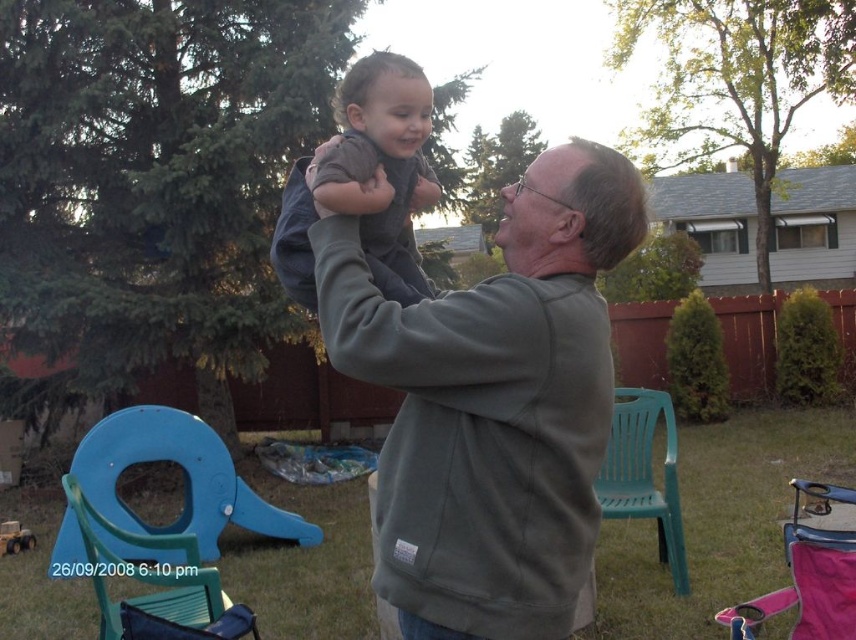
Question: Does pink fabric chair at lower right appear on the right side of green plastic chair at right?

Choices:
 (A) no
 (B) yes

Answer: (B)

Question: Which object is the farthest from the green plastic chair at right?

Choices:
 (A) matte gray hoodie at center
 (B) pink fabric chair at lower right
 (C) olive green sweatshirt at center

Answer: (C)

Question: Which point appears farthest from the camera in this image?

Choices:
 (A) (649, 417)
 (B) (189, 577)
 (C) (367, 186)
 (D) (556, 301)

Answer: (A)

Question: In this image, where is matte gray hoodie at center located relative to green plastic chair at right?

Choices:
 (A) right
 (B) left

Answer: (B)

Question: Can you confirm if blue plastic chair at lower left is wider than green plastic chair at right?

Choices:
 (A) no
 (B) yes

Answer: (B)

Question: Considering the real-world distances, which object is farthest from the blue plastic chair at lower left?

Choices:
 (A) green plastic chair at right
 (B) matte gray hoodie at center
 (C) pink fabric chair at lower right

Answer: (A)